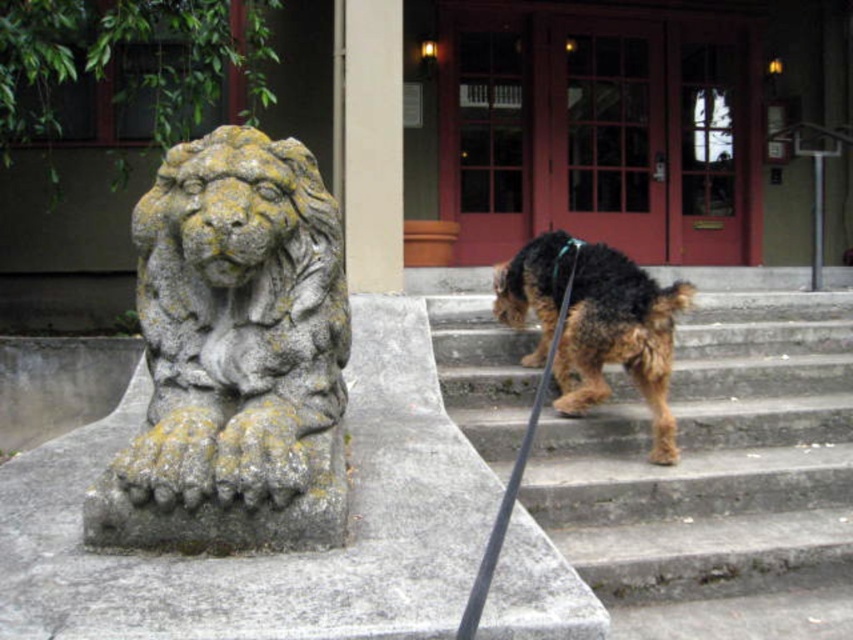
You are a delivery person holding a package and standing in front of the brown shaggy dog at center. The red double doors with glass panels are your destination. Can you walk directly to the doors without going around the dog?

The brown shaggy dog at center is 11.20 feet away from you. Since the distance is sufficient, you can walk directly to the red double doors with glass panels without needing to go around the dog.

You are an architect designing a pathway between the gray stone lion at left and the smooth concrete pillar at center. If the pathway must be wide enough to allow a 2.5 meter wide truck to pass, can you confirm if the space between them is sufficient?

The gray stone lion at left is wider than the smooth concrete pillar at center. However, the description does not provide specific measurements of their widths or the distance between them, so it is impossible to determine if the pathway is wide enough for a 2.5 meter wide truck.

You are standing in front of the building with the stone lion statue. You notice two points marked as point A and point B on the image. Point A is at coordinate point [335,456] and point B is at coordinate point [354,42]. If you were to walk towards the building, which point would you reach first, point A or point B?

Point A at coordinate point [335,456] is closer to the camera than point B at coordinate point [354,42], so you would reach point A first.